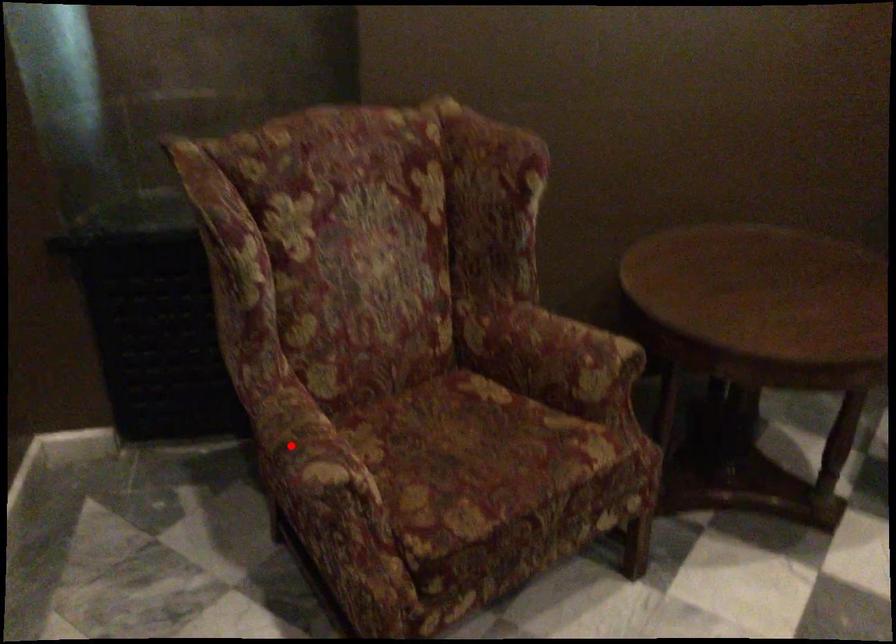
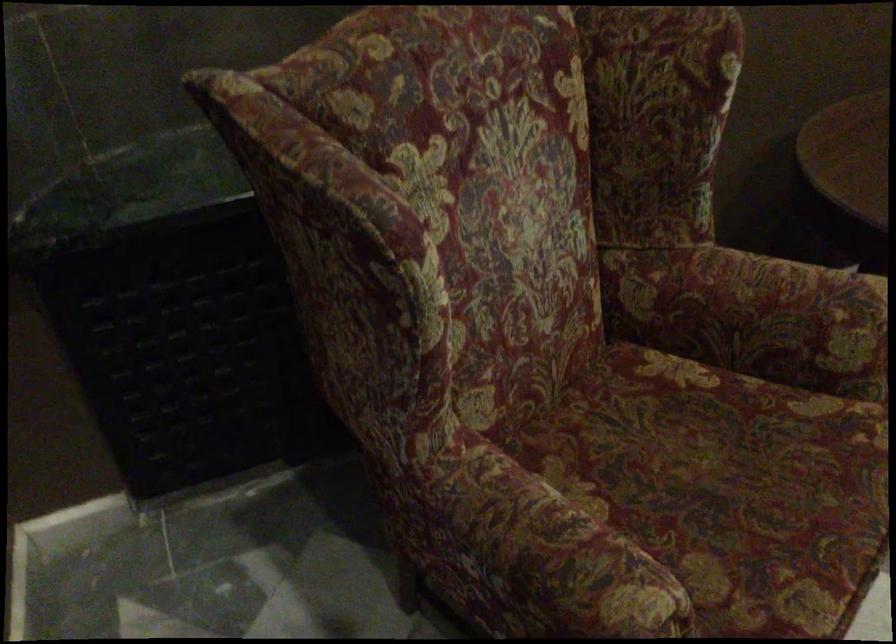
Locate, in the second image, the point that corresponds to the highlighted location in the first image.

(543, 559)